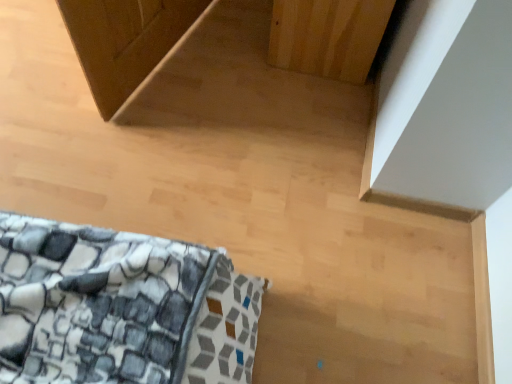
This screenshot has height=384, width=512. In order to click on vacant space to the left of natural wood cabinet at upper center in this screenshot , I will do `click(226, 44)`.